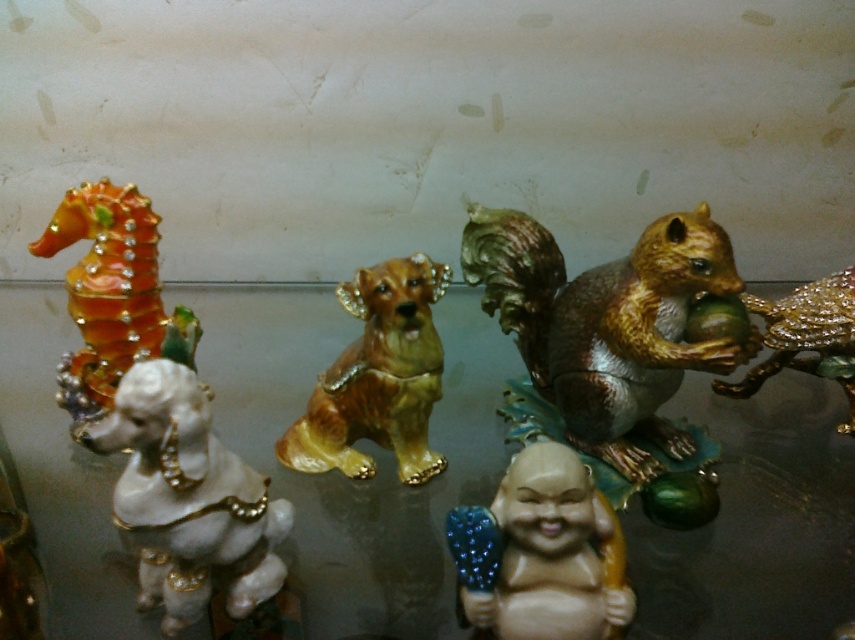
Between point (429, 547) and point (565, 570), which one is positioned in front?

Point (565, 570) is in front.

Does white glossy poodle at left have a larger size compared to porcelain beige figure at center?

Correct, white glossy poodle at left is larger in size than porcelain beige figure at center.

This screenshot has width=855, height=640. What are the coordinates of `white glossy poodle at left` in the screenshot? It's located at (361, 448).

Between shiny gold squirrel at center-right and shiny orange seahorse at left, which one is positioned lower?

shiny gold squirrel at center-right is lower down.

Who is positioned more to the left, shiny gold squirrel at center-right or shiny orange seahorse at left?

From the viewer's perspective, shiny orange seahorse at left appears more on the left side.

What do you see at coordinates (606, 324) in the screenshot? This screenshot has width=855, height=640. I see `shiny gold squirrel at center-right` at bounding box center [606, 324].

You are a GUI agent. You are given a task and a screenshot of the screen. Output one action in this format:
    pyautogui.click(x=<x>, y=<y>)
    Task: Click on the shiny gold squirrel at center-right
    The width and height of the screenshot is (855, 640).
    Given the screenshot: What is the action you would take?
    pyautogui.click(x=606, y=324)

Which of these two, white glossy poodle at left or white glossy dog at left, stands shorter?

white glossy dog at left

Can you confirm if white glossy poodle at left is positioned to the left of white glossy dog at left?

Incorrect, white glossy poodle at left is not on the left side of white glossy dog at left.

Locate an element on the screen. The image size is (855, 640). white glossy poodle at left is located at coordinates (361, 448).

Locate an element on the screen. The image size is (855, 640). white glossy poodle at left is located at coordinates (361, 448).